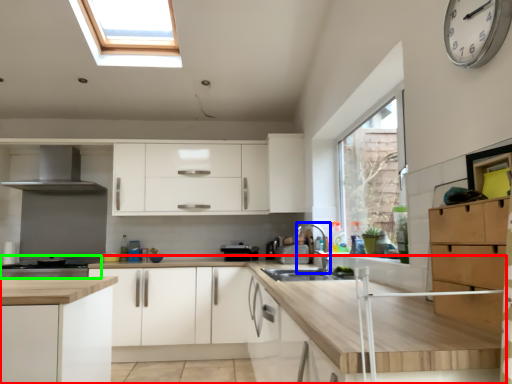
Question: Which is farther away from countertop (highlighted by a red box)? faucet (highlighted by a blue box) or home appliance (highlighted by a green box)?

Choices:
 (A) faucet
 (B) home appliance

Answer: (B)